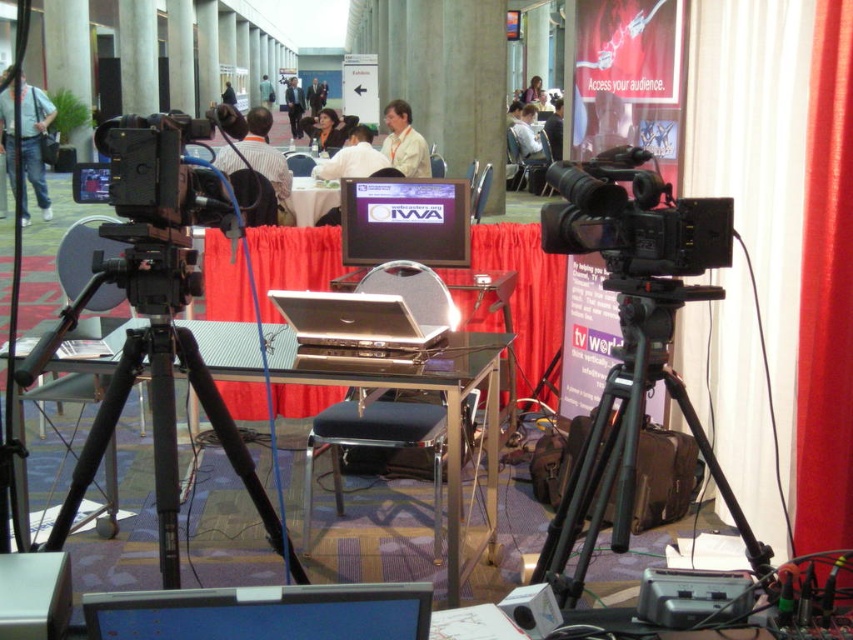
Question: From the image, what is the correct spatial relationship of black fabric chair at center in relation to light blue fabric jacket at center?

Choices:
 (A) left
 (B) right

Answer: (B)

Question: Which of the following is the closest to the observer?

Choices:
 (A) (537, 157)
 (B) (321, 202)

Answer: (B)

Question: Considering the relative positions of red velvet curtain at center and metallic glass table at center in the image provided, where is red velvet curtain at center located with respect to metallic glass table at center?

Choices:
 (A) right
 (B) left

Answer: (A)

Question: Which object is positioned farthest from the black leather stool at center?

Choices:
 (A) matte black jacket at left
 (B) black matte tripod at center

Answer: (A)

Question: Among these points, which one is nearest to the camera?

Choices:
 (A) (537, 99)
 (B) (294, 189)
 (C) (409, 154)
 (D) (628, 368)

Answer: (D)

Question: Considering the relative positions of matte black monitor at center and light brown leather jacket at upper center in the image provided, where is matte black monitor at center located with respect to light brown leather jacket at upper center?

Choices:
 (A) below
 (B) above

Answer: (A)